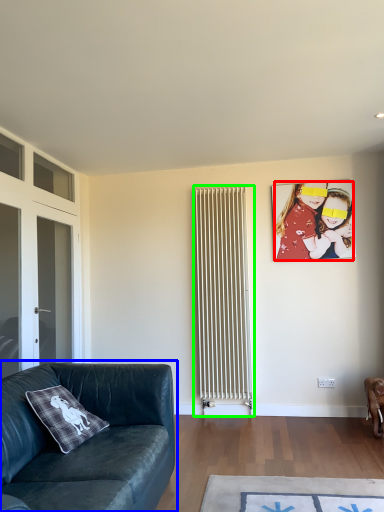
Question: Based on their relative distances, which object is nearer to person (highlighted by a red box)? Choose from studio couch (highlighted by a blue box) and radiator (highlighted by a green box).

Choices:
 (A) studio couch
 (B) radiator

Answer: (B)